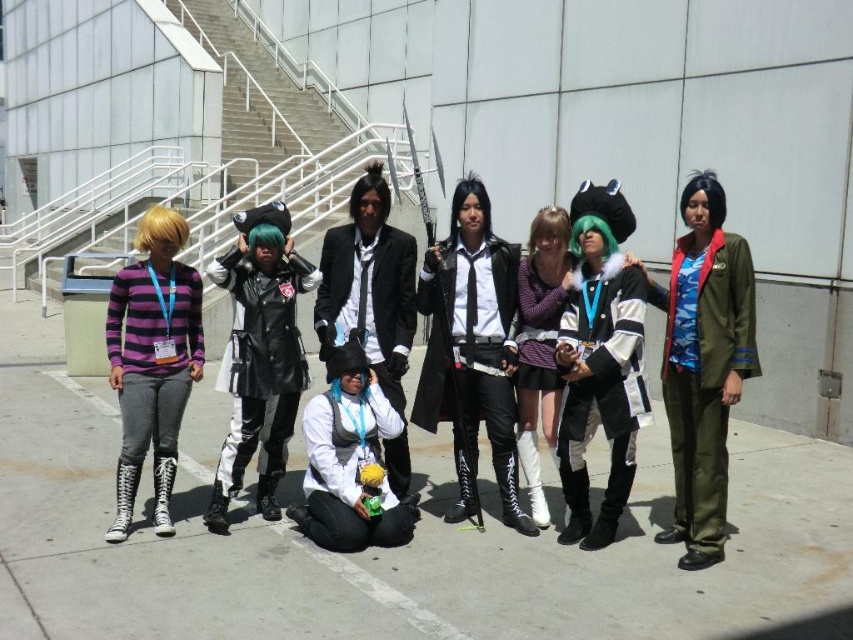
You are a photographer trying to capture a clear shot of the white matte vest at center and the camouflage fabric jacket at right. Since the vest is smaller, which object should you zoom in on more to ensure both are equally visible in the photo?

The white matte vest at center is smaller than the camouflage fabric jacket at right, so you should zoom in more on the white matte vest at center to make it appear larger in the photo, balancing its size with the camouflage fabric jacket at right.

You are a photographer trying to capture a closeup of the matte purple sweater at center. You are currently standing at the point marked as point (x=540, y=346). Can you confirm if you are already positioned directly on the matte purple sweater at center?

Yes, the point (x=540, y=346) is on the matte purple sweater at center, so you are positioned directly on it.